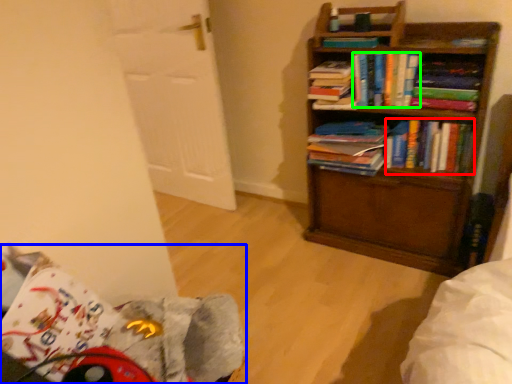
Question: Considering the real-world distances, which object is farthest from book (highlighted by a red box)? swivel chair (highlighted by a blue box) or book (highlighted by a green box)?

Choices:
 (A) swivel chair
 (B) book

Answer: (A)